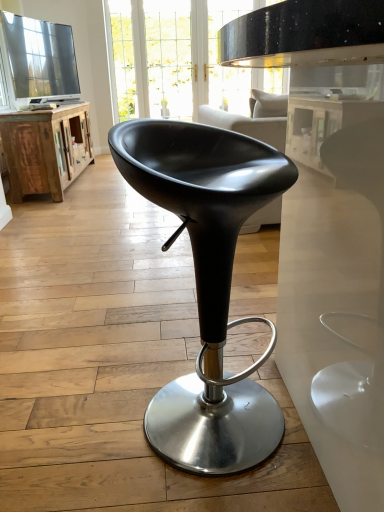
Question: Can you confirm if clear glass door at upper center is smaller than black leather stool at center?

Choices:
 (A) yes
 (B) no

Answer: (A)

Question: From a real-world perspective, is clear glass door at upper center located beneath black leather stool at center?

Choices:
 (A) no
 (B) yes

Answer: (A)

Question: Is clear glass door at upper center outside of black leather stool at center?

Choices:
 (A) no
 (B) yes

Answer: (B)

Question: Is clear glass door at upper center aimed at black leather stool at center?

Choices:
 (A) yes
 (B) no

Answer: (A)

Question: Can you confirm if clear glass door at upper center is thinner than black leather stool at center?

Choices:
 (A) no
 (B) yes

Answer: (B)

Question: In terms of height, does black leather stool at center look taller or shorter compared to clear glass door at upper center?

Choices:
 (A) tall
 (B) short

Answer: (B)

Question: Considering their positions, is black leather stool at center located in front of or behind clear glass door at upper center?

Choices:
 (A) behind
 (B) front

Answer: (B)

Question: In terms of size, does black leather stool at center appear bigger or smaller than clear glass door at upper center?

Choices:
 (A) big
 (B) small

Answer: (A)

Question: From a real-world perspective, is black leather stool at center positioned above or below clear glass door at upper center?

Choices:
 (A) above
 (B) below

Answer: (B)

Question: Do you think clear glass door at upper center is within black leather stool at center, or outside of it?

Choices:
 (A) inside
 (B) outside

Answer: (B)

Question: In terms of size, does clear glass door at upper center appear bigger or smaller than black leather stool at center?

Choices:
 (A) big
 (B) small

Answer: (B)

Question: Considering the positions of clear glass door at upper center and black leather stool at center in the image, is clear glass door at upper center taller or shorter than black leather stool at center?

Choices:
 (A) tall
 (B) short

Answer: (A)

Question: Is point (135, 96) positioned closer to the camera than point (147, 161)?

Choices:
 (A) closer
 (B) farther

Answer: (B)

Question: Is rustic wood cabinet at left bigger or smaller than clear glass door at upper center?

Choices:
 (A) big
 (B) small

Answer: (A)

Question: From a real-world perspective, is rustic wood cabinet at left physically located above or below clear glass door at upper center?

Choices:
 (A) above
 (B) below

Answer: (B)